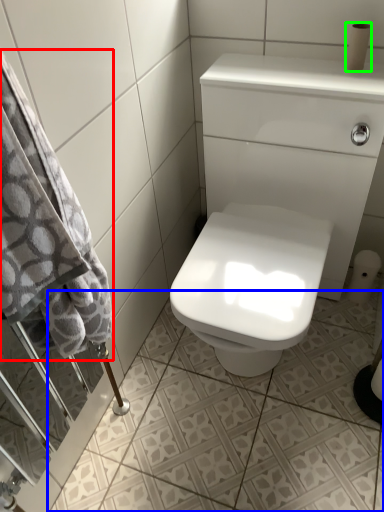
Question: Based on their relative distances, which object is nearer to bath towel (highlighted by a red box)? Choose from ceramic tile (highlighted by a blue box) and toilet paper (highlighted by a green box).

Choices:
 (A) ceramic tile
 (B) toilet paper

Answer: (A)